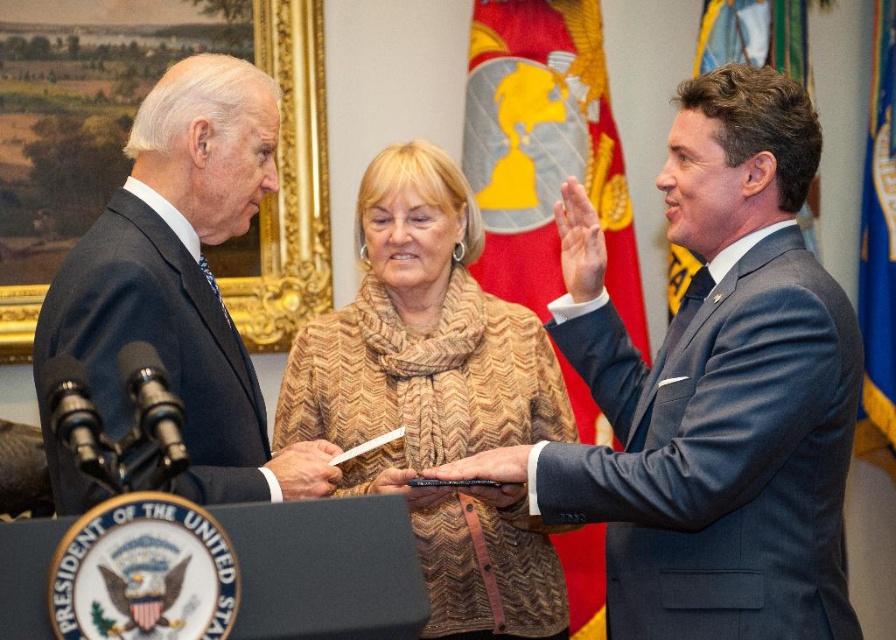
Question: Does dark blue wool suit at left have a lesser width compared to white matte hand at center?

Choices:
 (A) yes
 (B) no

Answer: (B)

Question: Which object is closer to the camera taking this photo?

Choices:
 (A) brown knitted sweater at center
 (B) matte gray suit at right

Answer: (B)

Question: Which point appears farthest from the camera in this image?

Choices:
 (A) (125, 406)
 (B) (618, 433)

Answer: (B)

Question: Does matte gray suit at right have a smaller size compared to dark blue wool suit at left?

Choices:
 (A) no
 (B) yes

Answer: (A)

Question: Which point appears closest to the camera in this image?

Choices:
 (A) (533, 556)
 (B) (707, 500)
 (C) (274, 481)

Answer: (B)

Question: Can you confirm if metallic pen at center is positioned below smooth leather pen at center?

Choices:
 (A) no
 (B) yes

Answer: (A)